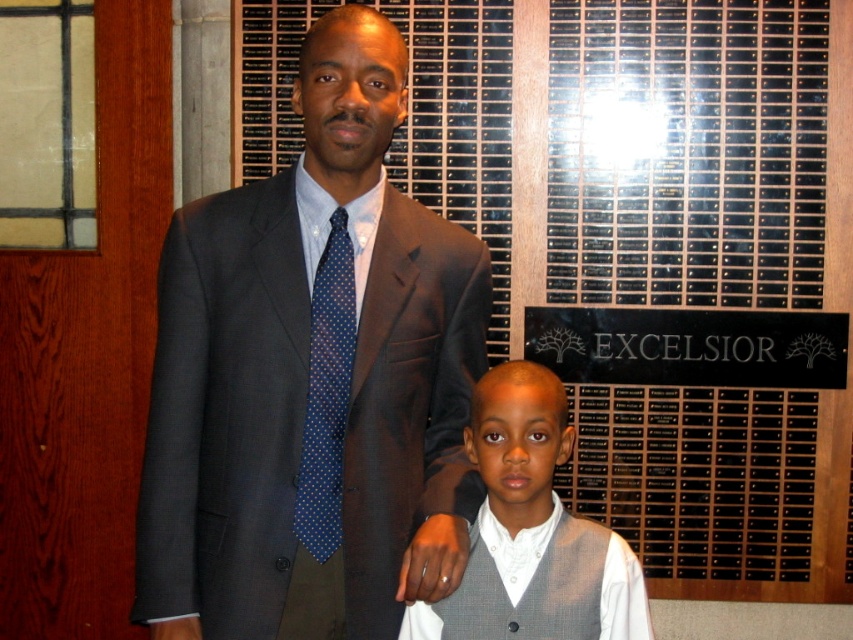
Question: Based on their relative distances, which object is nearer to the matte gray suit at center?

Choices:
 (A) blue dotted tie at center
 (B) gray textured vest at center

Answer: (A)

Question: Can you confirm if matte gray suit at center is positioned to the left of blue dotted tie at center?

Choices:
 (A) yes
 (B) no

Answer: (B)

Question: Can you confirm if matte gray suit at center is positioned above gray textured vest at center?

Choices:
 (A) no
 (B) yes

Answer: (B)

Question: Does gray textured vest at center have a lesser width compared to blue dotted tie at center?

Choices:
 (A) no
 (B) yes

Answer: (A)

Question: Which point is farther to the camera?

Choices:
 (A) matte gray suit at center
 (B) blue dotted tie at center
 (C) gray textured vest at center

Answer: (C)

Question: Which of these objects is positioned closest to the gray textured vest at center?

Choices:
 (A) matte gray suit at center
 (B) blue dotted tie at center

Answer: (A)